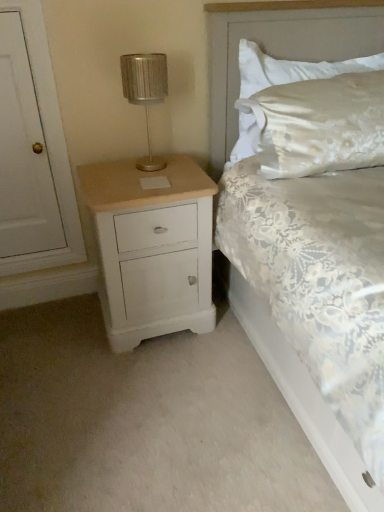
Question: Does white lace bed at center have a greater width compared to metallic silver table lamp at upper left?

Choices:
 (A) yes
 (B) no

Answer: (A)

Question: Can you confirm if white lace bed at center is taller than metallic silver table lamp at upper left?

Choices:
 (A) no
 (B) yes

Answer: (B)

Question: From the image's perspective, would you say white lace bed at center is shown under metallic silver table lamp at upper left?

Choices:
 (A) yes
 (B) no

Answer: (A)

Question: Considering the relative sizes of white lace bed at center and metallic silver table lamp at upper left in the image provided, is white lace bed at center smaller than metallic silver table lamp at upper left?

Choices:
 (A) no
 (B) yes

Answer: (A)

Question: From the image's perspective, is white lace bed at center on metallic silver table lamp at upper left?

Choices:
 (A) yes
 (B) no

Answer: (B)

Question: Can you confirm if white lace bed at center is positioned to the right of metallic silver table lamp at upper left?

Choices:
 (A) yes
 (B) no

Answer: (A)

Question: Is white painted wood door at left bigger than metallic silver table lamp at upper left?

Choices:
 (A) no
 (B) yes

Answer: (B)

Question: Does white painted wood door at left have a lesser height compared to metallic silver table lamp at upper left?

Choices:
 (A) yes
 (B) no

Answer: (B)

Question: Is white painted wood door at left positioned before metallic silver table lamp at upper left?

Choices:
 (A) yes
 (B) no

Answer: (A)

Question: From a real-world perspective, is white painted wood door at left positioned under metallic silver table lamp at upper left based on gravity?

Choices:
 (A) yes
 (B) no

Answer: (A)

Question: Is white painted wood door at left placed right next to metallic silver table lamp at upper left?

Choices:
 (A) yes
 (B) no

Answer: (B)

Question: From the image's perspective, is white painted wood door at left on metallic silver table lamp at upper left?

Choices:
 (A) yes
 (B) no

Answer: (B)

Question: Can we say satin white pillow at upper right lies outside white lace bed at center?

Choices:
 (A) yes
 (B) no

Answer: (B)